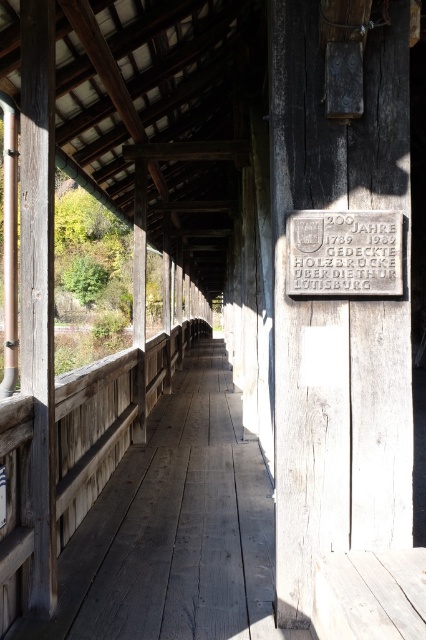
Is the position of weathered wood porch at center more distant than that of gray stone plaque at center?

No, it is in front of gray stone plaque at center.

Does weathered wood porch at center have a smaller size compared to gray stone plaque at center?

Actually, weathered wood porch at center might be larger than gray stone plaque at center.

Who is more forward, (178,628) or (287,218)?

Point (287,218) is in front.

In order to click on weathered wood porch at center in this screenshot , I will do `click(175, 529)`.

Is point (337, 468) positioned before point (169, 522)?

Yes, point (337, 468) is in front of point (169, 522).

Does weathered wood sign at right appear under weathered wood porch at center?

No, weathered wood sign at right is not below weathered wood porch at center.

Identify the location of weathered wood sign at right. (337, 310).

Who is higher up, weathered wood sign at right or gray stone plaque at center?

gray stone plaque at center is higher up.

Can you confirm if weathered wood sign at right is positioned below gray stone plaque at center?

Indeed, weathered wood sign at right is positioned under gray stone plaque at center.

You are a GUI agent. You are given a task and a screenshot of the screen. Output one action in this format:
    pyautogui.click(x=<x>, y=<y>)
    Task: Click on the weathered wood sign at right
    This screenshot has width=426, height=640.
    Given the screenshot: What is the action you would take?
    [337, 310]

The width and height of the screenshot is (426, 640). In order to click on weathered wood sign at right in this screenshot , I will do `click(337, 310)`.